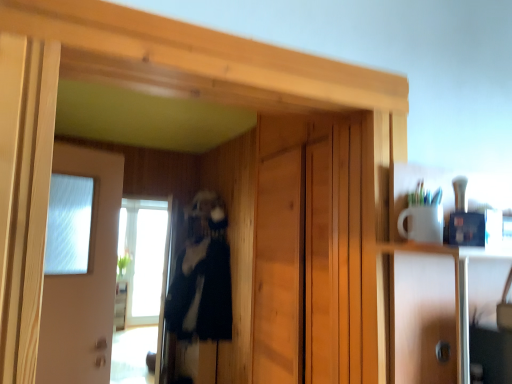
Question: Is transparent glass screen door at left positioned behind white glossy door at left?

Choices:
 (A) yes
 (B) no

Answer: (A)

Question: Does transparent glass screen door at left have a lesser height compared to white glossy door at left?

Choices:
 (A) no
 (B) yes

Answer: (A)

Question: Is transparent glass screen door at left thinner than white glossy door at left?

Choices:
 (A) no
 (B) yes

Answer: (A)

Question: Is there a large distance between transparent glass screen door at left and white glossy door at left?

Choices:
 (A) yes
 (B) no

Answer: (A)

Question: Can you confirm if transparent glass screen door at left is smaller than white glossy door at left?

Choices:
 (A) no
 (B) yes

Answer: (A)

Question: Is point pyautogui.click(x=143, y=225) closer or farther from the camera than point pyautogui.click(x=181, y=327)?

Choices:
 (A) farther
 (B) closer

Answer: (A)

Question: Considering the positions of transparent glass screen door at left and black fuzzy coat at center in the image, is transparent glass screen door at left bigger or smaller than black fuzzy coat at center?

Choices:
 (A) small
 (B) big

Answer: (A)

Question: From the image's perspective, relative to black fuzzy coat at center, is transparent glass screen door at left above or below?

Choices:
 (A) above
 (B) below

Answer: (B)

Question: From a real-world perspective, relative to black fuzzy coat at center, is transparent glass screen door at left vertically above or below?

Choices:
 (A) below
 (B) above

Answer: (A)

Question: From a real-world perspective, is transparent glass screen door at left positioned above or below transparent glass window at center?

Choices:
 (A) above
 (B) below

Answer: (B)

Question: Considering their positions, is transparent glass screen door at left located in front of or behind transparent glass window at center?

Choices:
 (A) front
 (B) behind

Answer: (A)

Question: Is point (159, 258) positioned closer to the camera than point (162, 210)?

Choices:
 (A) closer
 (B) farther

Answer: (B)

Question: Considering the positions of transparent glass screen door at left and transparent glass window at center in the image, is transparent glass screen door at left taller or shorter than transparent glass window at center?

Choices:
 (A) tall
 (B) short

Answer: (A)

Question: Considering the relative positions of transparent glass window at center and white glossy door at left in the image provided, is transparent glass window at center to the left or to the right of white glossy door at left?

Choices:
 (A) right
 (B) left

Answer: (B)

Question: Choose the correct answer: Is transparent glass window at center inside white glossy door at left or outside it?

Choices:
 (A) inside
 (B) outside

Answer: (B)